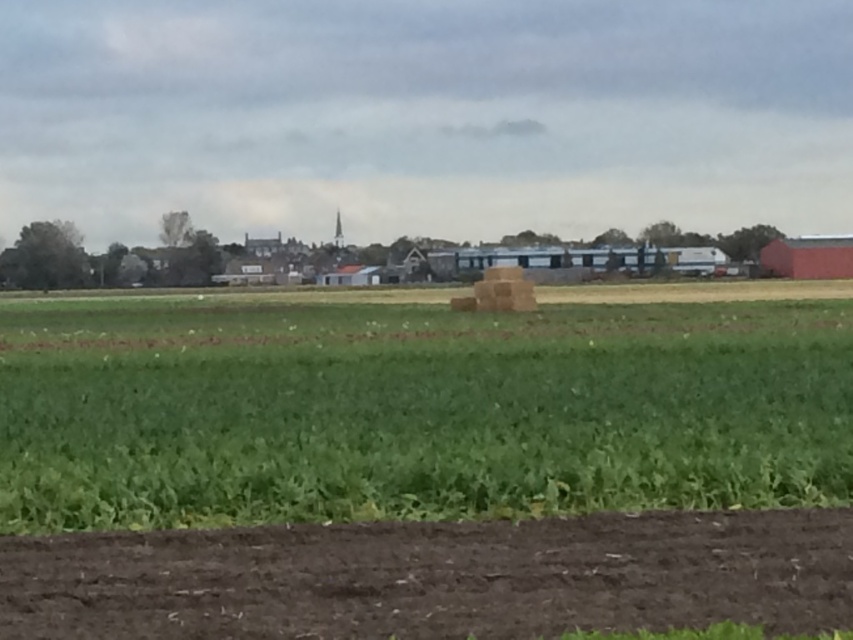
You are a farmer planning to plant a row of sunflowers. You have two areas to choose from in the image provided. The first is the green grassy field at center, and the second is the brown soil at lower center. Based on the scene description, which area is more suitable for planting sunflowers and why?

The green grassy field at center is more suitable for planting sunflowers because it is wider than the brown soil at lower center, indicating it has more space for the row of sunflowers.

You are standing in the rural landscape looking at the scene. There are two points marked in the image, point 1 at coordinates point [196,348] and point 2 at coordinates point [364,540]. Which point is closer to you?

Point [196,348] is closer to you because it is further to the camera than point [364,540].

Based on the scene description, where is the green grassy field at center located in terms of its 2D coordinates?

The green grassy field at center is located at the 2D coordinates of point (415, 410).